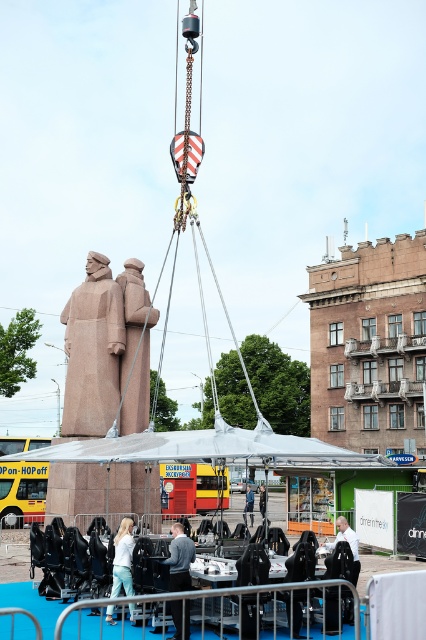
You are a construction worker who needs to ensure the brown granite statue at center and the light blue jeans at lower left can both fit inside a storage container. The container has a height limit of 3 meters. If the statue is 4 meters tall and the jeans are 1 meter tall, will both items exceed the container height limit?

The brown granite statue at center is 4 meters tall, which exceeds the container height limit of 3 meters. The light blue jeans at lower left are 1 meter tall, which is within the limit. Therefore, only the brown granite statue at center will exceed the height limit.

You are standing at the origin point of the coordinate system in the image. The brown granite statue at center is located at point (135,348). Can you tell me the coordinates of the brown granite statue at center?

The coordinates of the brown granite statue at center are exactly at point (135,348).